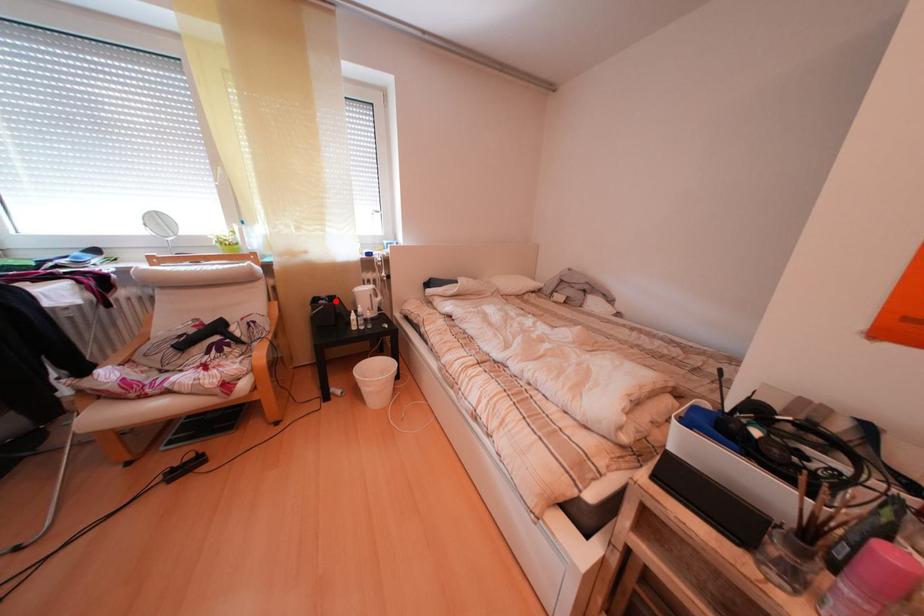
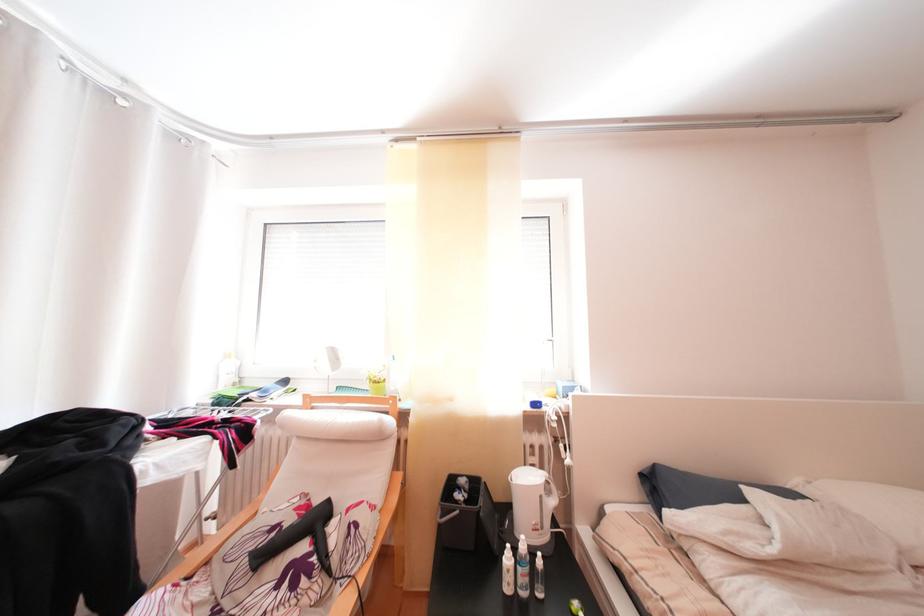
Question: A red point is marked in image1. In image2, is the corresponding 3D point closer to the camera or farther? Reply with the corresponding letter.

Choices:
 (A) The corresponding 3D point is closer.
 (B) The corresponding 3D point is farther.

Answer: (B)